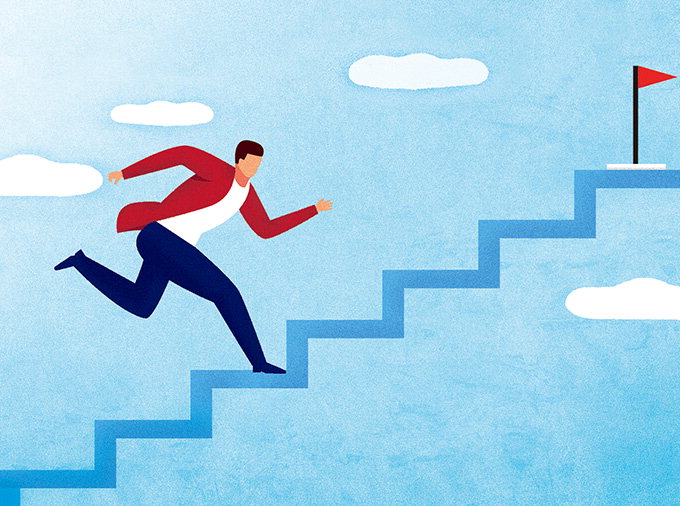
At what (x,y) coordinates should I click in order to perform the action: click on stair. Please return your answer as a coordinate pair (x, y). Looking at the image, I should click on (30, 475), (114, 418), (209, 378), (304, 326), (392, 286), (489, 232), (585, 178).